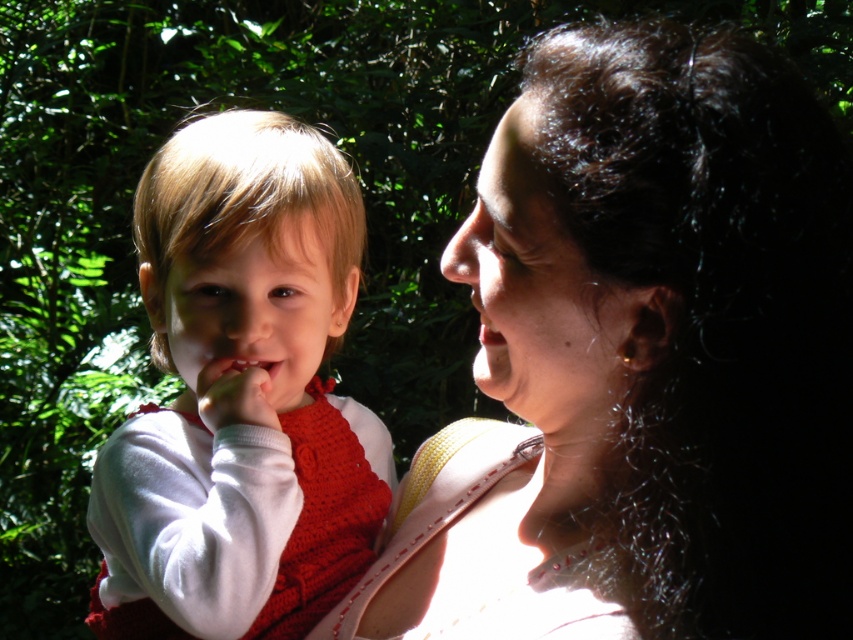
Question: Is matte skin nose at center positioned at the back of matte white teeth at center?

Choices:
 (A) yes
 (B) no

Answer: (A)

Question: Is smooth skin nose at center above matte white teeth at center?

Choices:
 (A) no
 (B) yes

Answer: (B)

Question: Which of the following is the farthest from the observer?

Choices:
 (A) (709, 458)
 (B) (239, 381)
 (C) (459, 252)
 (D) (242, 348)

Answer: (D)

Question: Among these points, which one is nearest to the camera?

Choices:
 (A) (245, 353)
 (B) (776, 460)
 (C) (277, 362)

Answer: (B)

Question: Is matte white skin at upper right thinner than matte skin nose at center?

Choices:
 (A) yes
 (B) no

Answer: (B)

Question: Which point is closer to the camera?

Choices:
 (A) (798, 248)
 (B) (339, 308)
 (C) (259, 378)
 (D) (480, 272)

Answer: (A)